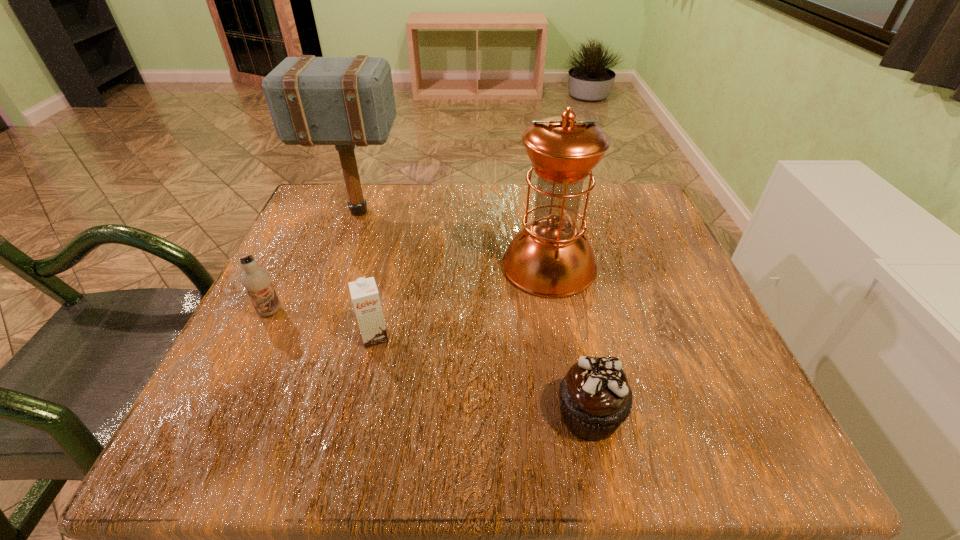
This screenshot has width=960, height=540. In order to click on mallet in this screenshot , I will do `click(344, 101)`.

At what (x,y) coordinates should I click in order to perform the action: click on oil lamp. Please return your answer as a coordinate pair (x, y). Looking at the image, I should click on (550, 257).

In order to click on the left chocolate milk in this screenshot , I will do `click(257, 281)`.

The height and width of the screenshot is (540, 960). I want to click on the farther chocolate milk, so click(x=257, y=281).

The height and width of the screenshot is (540, 960). I want to click on the second nearest object, so click(364, 293).

You are a GUI agent. You are given a task and a screenshot of the screen. Output one action in this format:
    pyautogui.click(x=<x>, y=<y>)
    Task: Click on the right chocolate milk
    This screenshot has width=960, height=540.
    Given the screenshot: What is the action you would take?
    pyautogui.click(x=364, y=293)

This screenshot has width=960, height=540. Identify the location of the shortest object. (595, 398).

Identify the location of cupcake. The width and height of the screenshot is (960, 540). (595, 398).

The image size is (960, 540). What are the coordinates of `vacant space located 0.250m on the striking surface of the mallet` in the screenshot? It's located at (509, 212).

At what (x,y) coordinates should I click in order to perform the action: click on vacant point located 0.210m on the left of the oil lamp. Please return your answer as a coordinate pair (x, y). The width and height of the screenshot is (960, 540). Looking at the image, I should click on (399, 266).